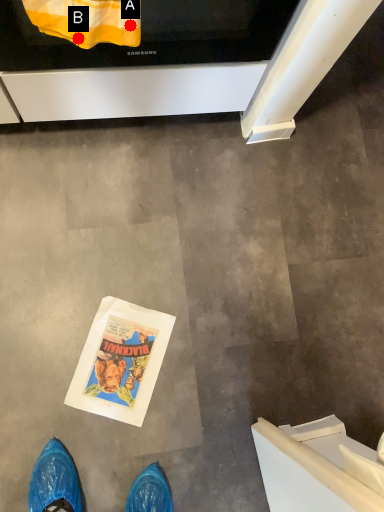
Question: Two points are circled on the image, labeled by A and B beside each circle. Which point is further to the camera?

Choices:
 (A) A is further
 (B) B is further

Answer: (B)